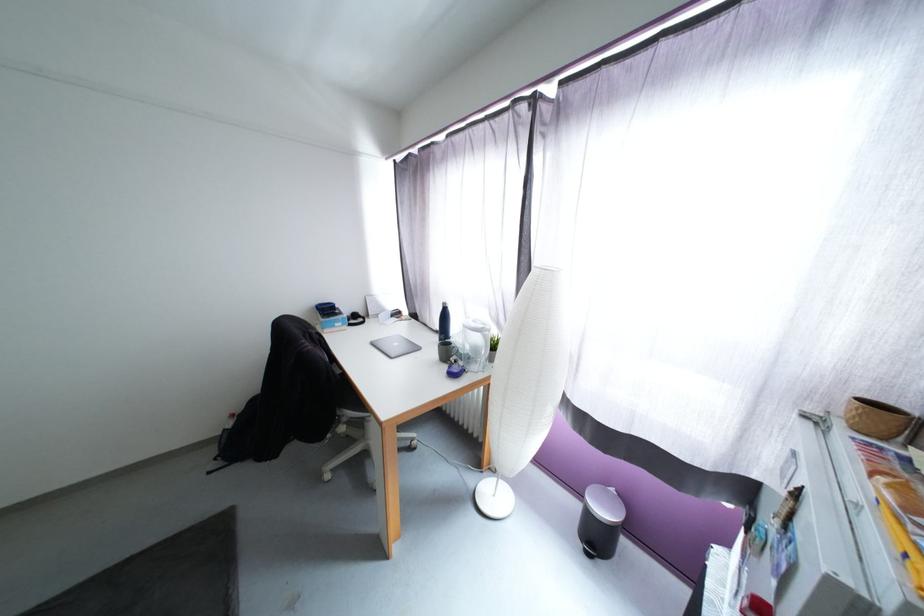
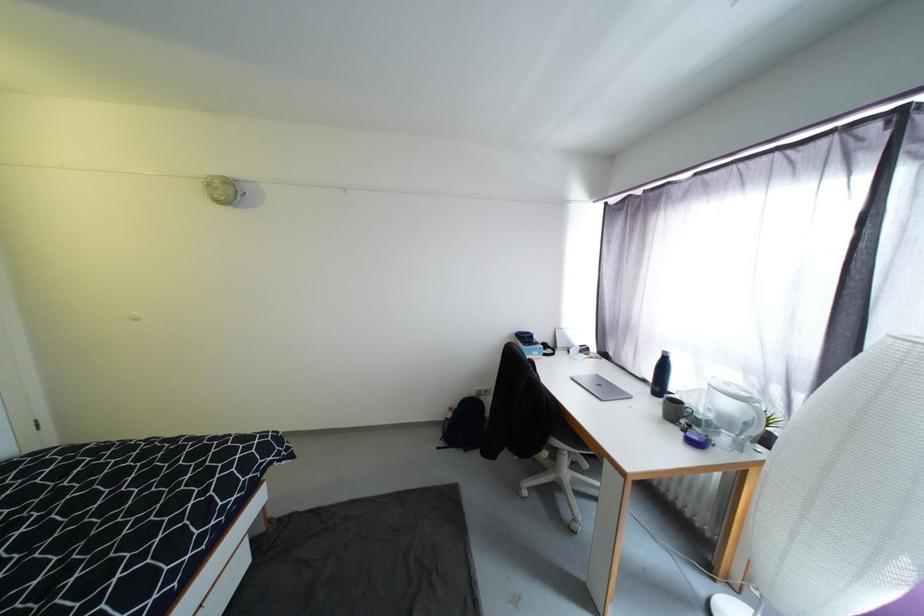
Where in the second image is the point corresponding to (237,416) from the first image?

(456, 410)